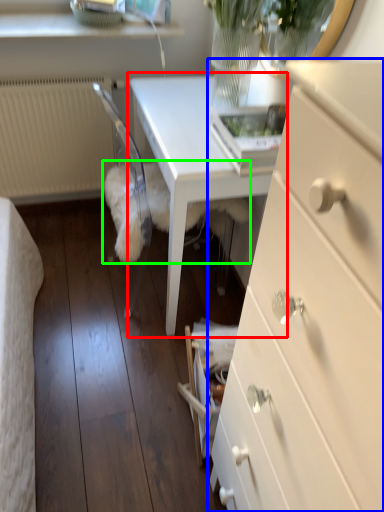
Question: Which object is positioned closest to table (highlighted by a red box)? Select from chest of drawers (highlighted by a blue box) and animal (highlighted by a green box).

Choices:
 (A) chest of drawers
 (B) animal

Answer: (B)